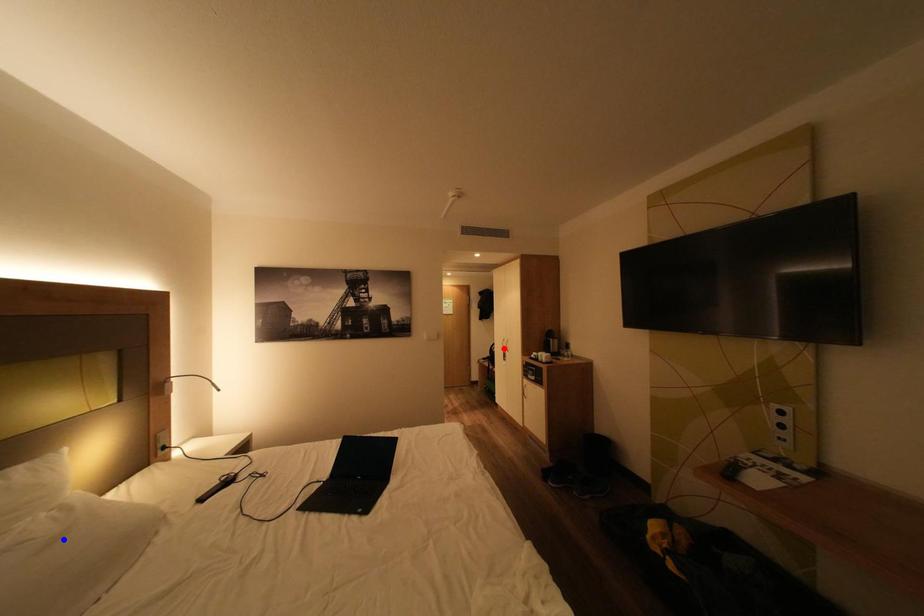
Question: In the image, two points are highlighted. Which point is nearer to the camera? Reply with the corresponding letter.

Choices:
 (A) blue point
 (B) red point

Answer: (A)